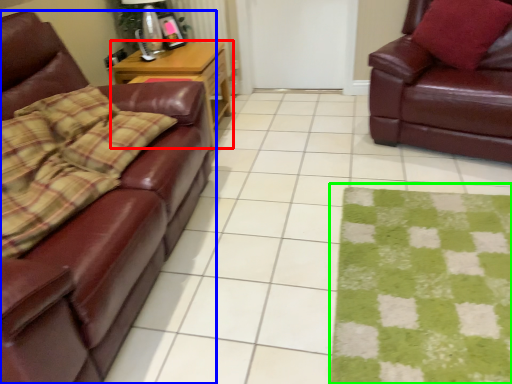
Question: Which object is the farthest from table (highlighted by a red box)? Choose among these: studio couch (highlighted by a blue box) or mat (highlighted by a green box).

Choices:
 (A) studio couch
 (B) mat

Answer: (B)